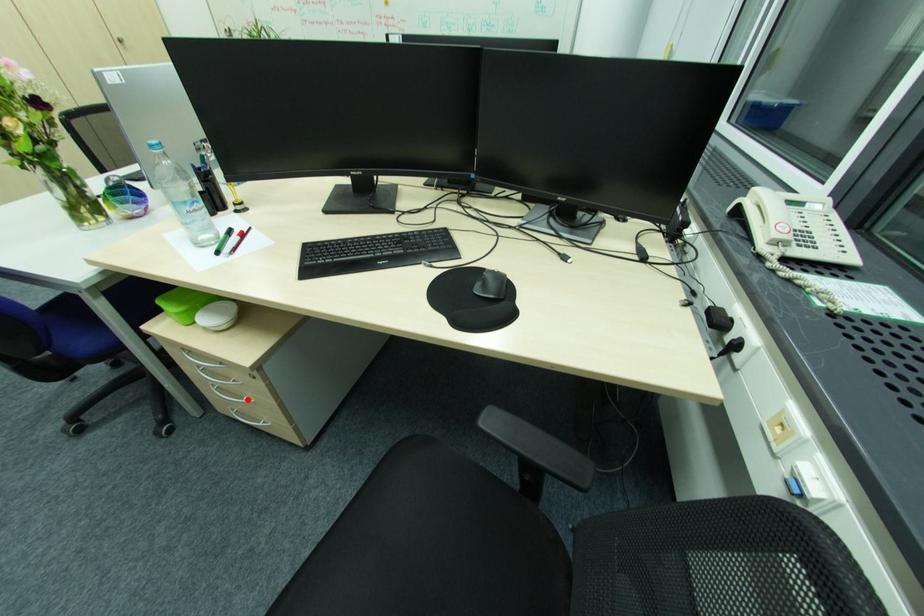
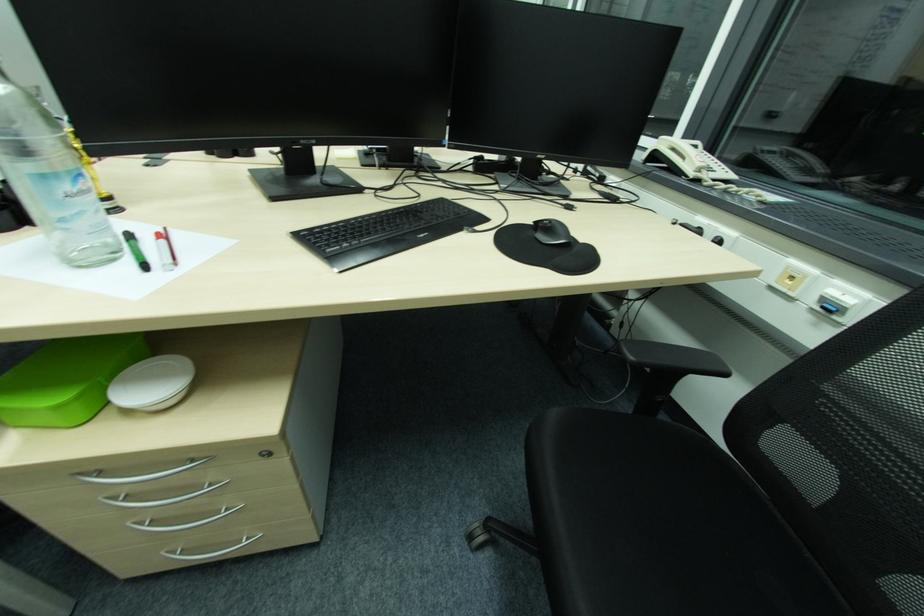
Where in the second image is the point corresponding to the highlighted location from the first image?

(225, 513)